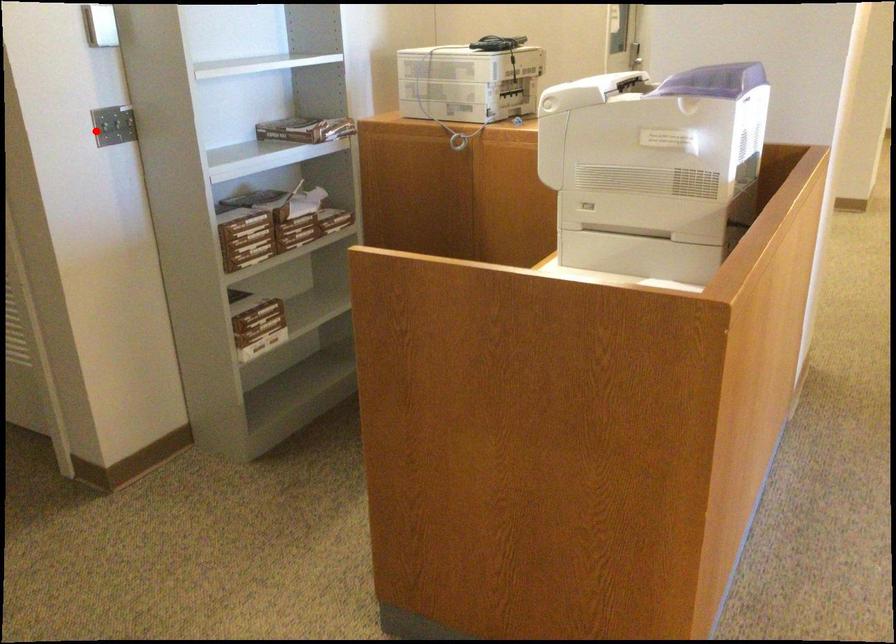
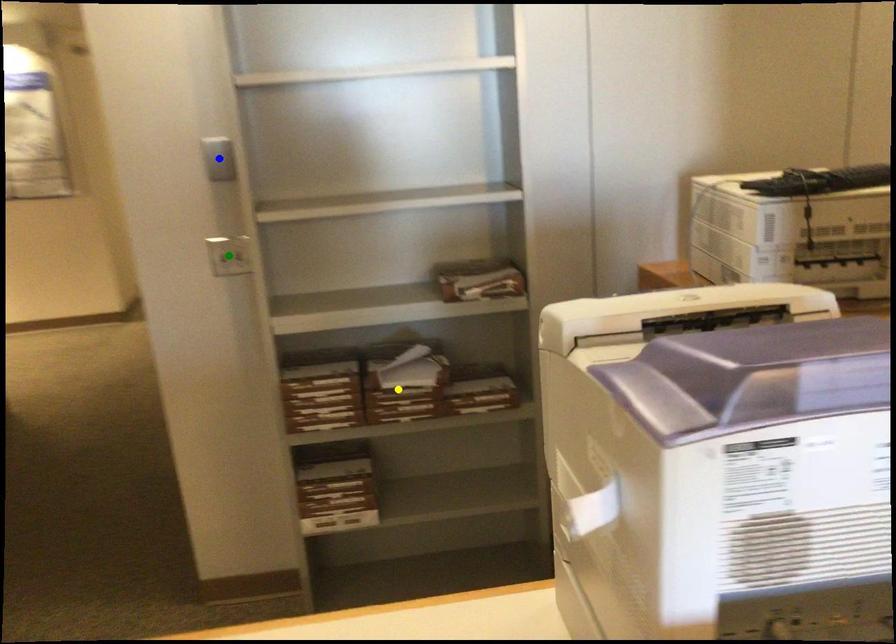
Question: I am providing you with two images of the same scene from different viewpoints. A red point is marked on the first image. You are given multiple points on the second image. In image 2, which mark is for the same physical point as the one in image 1?

Choices:
 (A) blue point
 (B) yellow point
 (C) green point

Answer: (C)